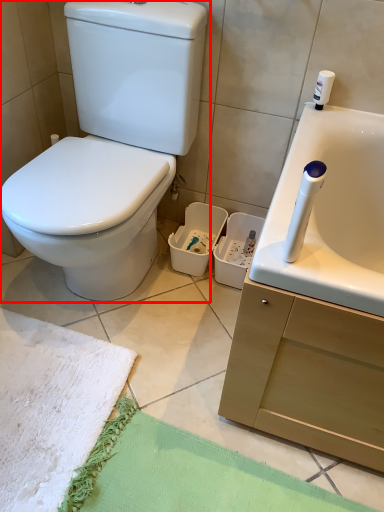
Question: From the image's perspective, where is toilet (annotated by the red box) located relative to beach towel?

Choices:
 (A) below
 (B) above

Answer: (B)